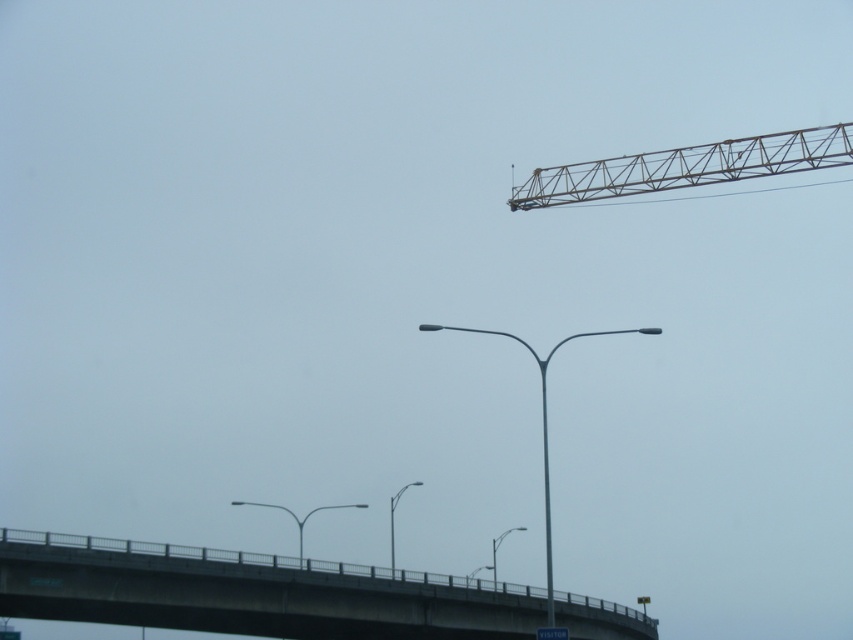
Is concrete bridge at lower center wider than metallic gray crane at upper right?

Correct, the width of concrete bridge at lower center exceeds that of metallic gray crane at upper right.

Describe the element at coordinates (248, 593) in the screenshot. I see `concrete bridge at lower center` at that location.

Is point (109, 584) less distant than point (521, 182)?

Yes, point (109, 584) is in front of point (521, 182).

Locate an element on the screen. concrete bridge at lower center is located at coordinates (248, 593).